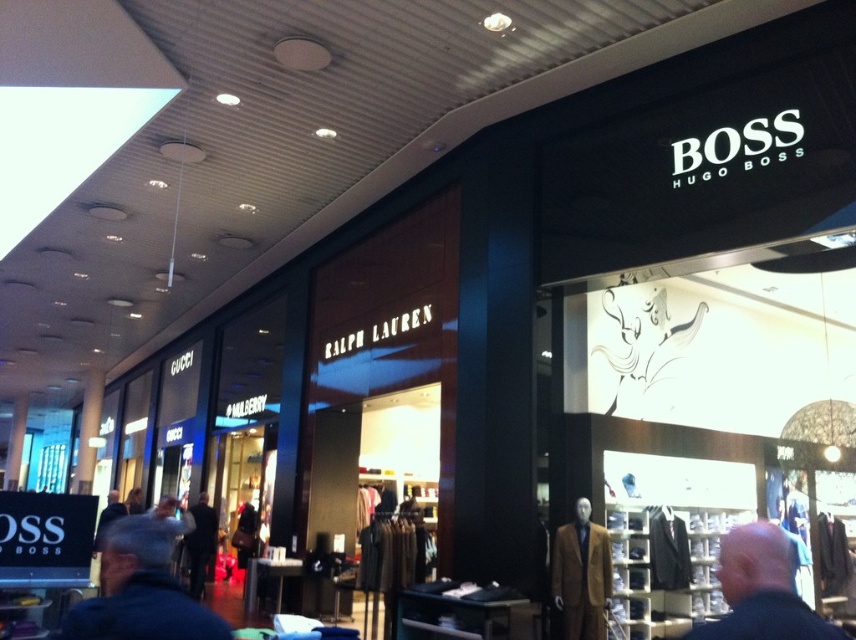
Question: Among these points, which one is farthest from the camera?

Choices:
 (A) (777, 611)
 (B) (187, 544)

Answer: (B)

Question: Can you confirm if dark blue jacket at lower left is wider than dark brown leather jacket at lower left?

Choices:
 (A) yes
 (B) no

Answer: (A)

Question: Does dark blue jacket at center have a larger size compared to dark brown leather jacket at lower left?

Choices:
 (A) no
 (B) yes

Answer: (A)

Question: Does dark blue jacket at lower left have a lesser width compared to brown wool suit at center?

Choices:
 (A) no
 (B) yes

Answer: (A)

Question: Which point is farther to the camera?

Choices:
 (A) (589, 593)
 (B) (192, 593)
 (C) (68, 628)

Answer: (B)

Question: Based on their relative distances, which object is nearer to the brown wool suit at center?

Choices:
 (A) dark blue jacket at lower left
 (B) dark blue jacket at center
 (C) dark brown leather jacket at lower left

Answer: (B)